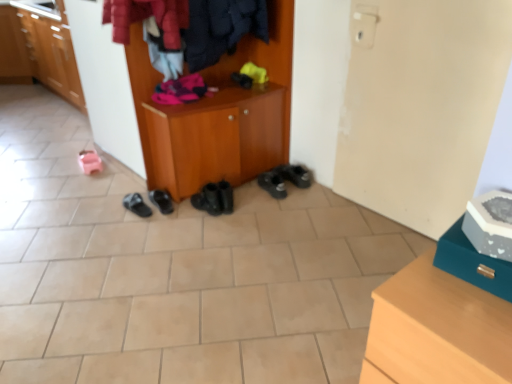
Where is `free space in front of black rubber shoes at center, the 4th footwear positioned from the right`? free space in front of black rubber shoes at center, the 4th footwear positioned from the right is located at coordinates (153, 224).